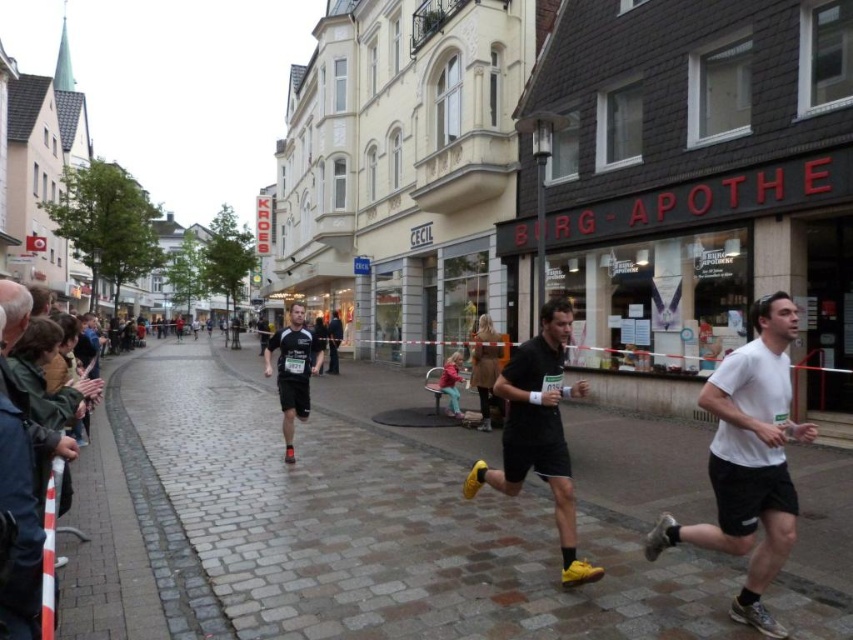
You are a photographer standing on the street and want to take a photo of the white matte shirt at right and the black matte running shoe at center. Which object should you focus on first to ensure both are in sharp focus?

You should focus on the white matte shirt at right first because it is closer to the viewer than the black matte running shoe at center, so adjusting focus from near to far will help both objects be in sharp focus.